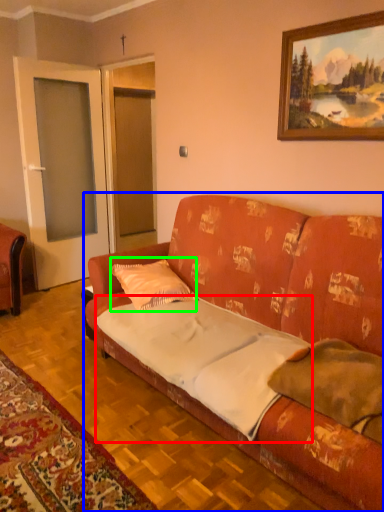
Question: Estimate the real-world distances between objects in this image. Which object is closer to sheet (highlighted by a red box), studio couch (highlighted by a blue box) or pillow (highlighted by a green box)?

Choices:
 (A) studio couch
 (B) pillow

Answer: (A)